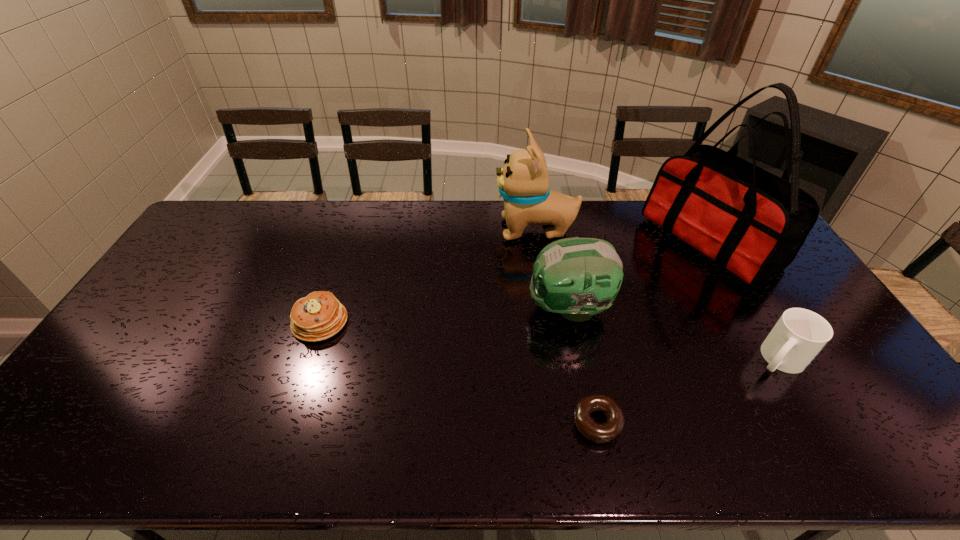
Image resolution: width=960 pixels, height=540 pixels. What are the coordinates of `free space between the football helmet and the pancake` in the screenshot? It's located at (444, 315).

Where is `unoccupied position between the leftmost object and the fourth shortest object`? This screenshot has height=540, width=960. unoccupied position between the leftmost object and the fourth shortest object is located at coordinates (444, 315).

Where is `empty location between the pancake and the puppy`? Image resolution: width=960 pixels, height=540 pixels. empty location between the pancake and the puppy is located at coordinates (428, 276).

Image resolution: width=960 pixels, height=540 pixels. Identify the location of vacant space in between the nearest object and the third tallest object. (583, 365).

The image size is (960, 540). In order to click on free space that is in between the football helmet and the mug in this screenshot , I will do [674, 334].

Locate an element on the screen. the closest object to the doughnut is located at coordinates (577, 277).

Identify which object is located as the fourth nearest to the puppy. Please provide its 2D coordinates. Your answer should be formatted as a tuple, i.e. [(x, y)], where the tuple contains the x and y coordinates of a point satisfying the conditions above.

[(799, 335)]

You are a GUI agent. You are given a task and a screenshot of the screen. Output one action in this format:
    pyautogui.click(x=<x>, y=<y>)
    Task: Click on the vacant space that satisfies the following two spatial constraints: 1. on the face of the doughnut; 2. on the right side of the puppy
    The image size is (960, 540).
    Given the screenshot: What is the action you would take?
    pyautogui.click(x=564, y=422)

You are a GUI agent. You are given a task and a screenshot of the screen. Output one action in this format:
    pyautogui.click(x=<x>, y=<y>)
    Task: Click on the vacant point that satisfies the following two spatial constraints: 1. on the face of the mug; 2. on the right side of the puppy
    Image resolution: width=960 pixels, height=540 pixels.
    Given the screenshot: What is the action you would take?
    pyautogui.click(x=555, y=359)

This screenshot has width=960, height=540. I want to click on vacant space that satisfies the following two spatial constraints: 1. on the face of the shortest object; 2. on the right side of the puppy, so click(564, 422).